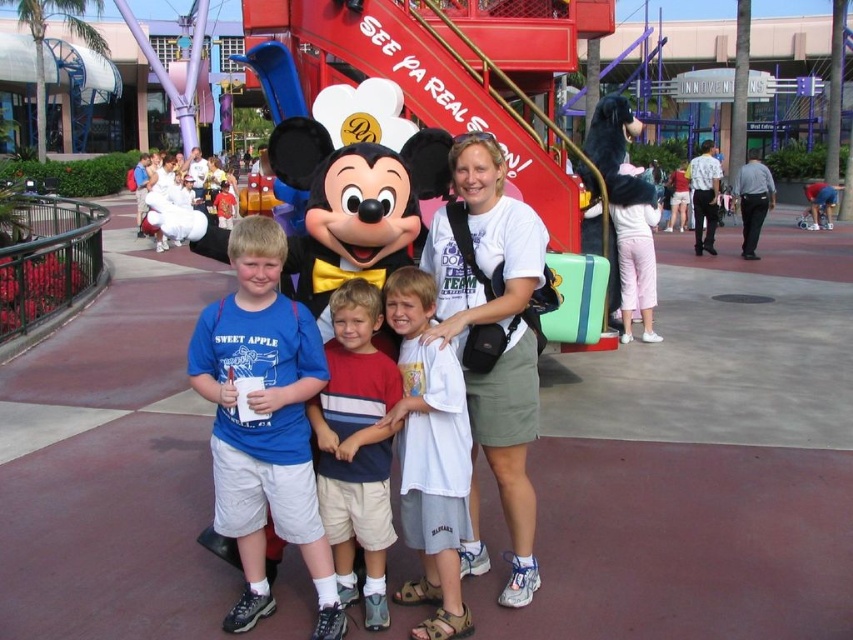
Based on the photo, in the theme park photo, you see a white cotton shirt at center and a light brown cotton shorts at center. Which clothing item is positioned more to the right?

The white cotton shirt at center is positioned to the right of the light brown cotton shorts at center, so the white cotton shirt at center is more to the right.

You are a photographer at the theme park and need to capture a photo where the matte black costume at center and the white plush bear at upper left are both visible. Based on their positions, where should you position the camera relative to the subjects?

The matte black costume at center is positioned under the white plush bear at upper left, so to capture both subjects in the frame, the camera should be positioned above the matte black costume at center and below the white plush bear at upper left to ensure both are visible.

You are standing in the theme park scene and want to place a small flower pot between the two points labeled point (x=427, y=436) and point (x=364, y=508). Which point should the flower pot be closer to in order to be nearer to the viewer?

The flower pot should be closer to point (x=427, y=436) because it is closer to the viewer than point (x=364, y=508).